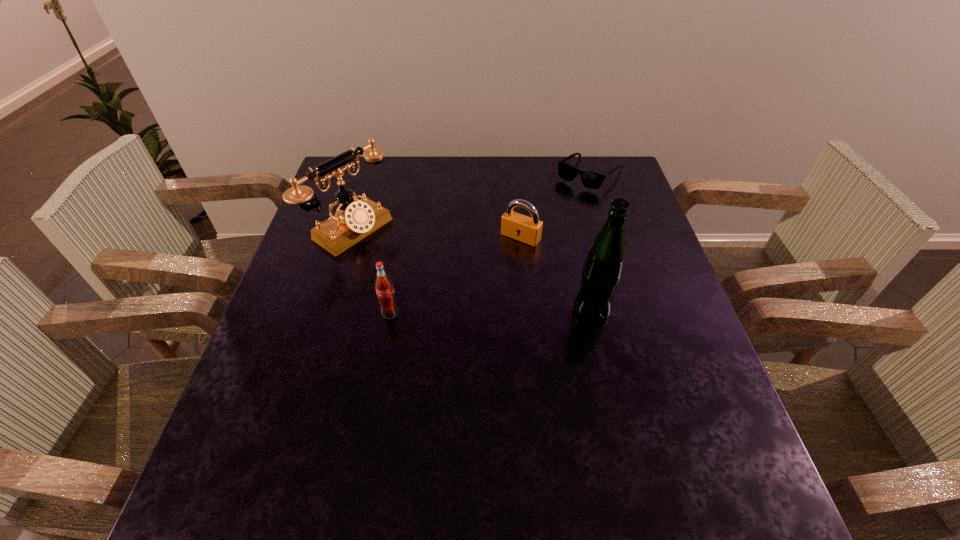
The image size is (960, 540). I want to click on vacant spot on the desktop that is between the soda bottle and the tallest object and is positioned on the dial of the telephone, so click(480, 312).

The image size is (960, 540). What are the coordinates of `vacant spot on the desktop that is between the third tallest object and the beer bottle and is positioned to unlock the fourth tallest object from the front` in the screenshot? It's located at (461, 313).

Find the location of a particular element. This screenshot has height=540, width=960. free spot on the desktop that is between the fourth object from right to left and the beer bottle and is positioned on the front-facing side of the farthest object is located at coordinates (471, 312).